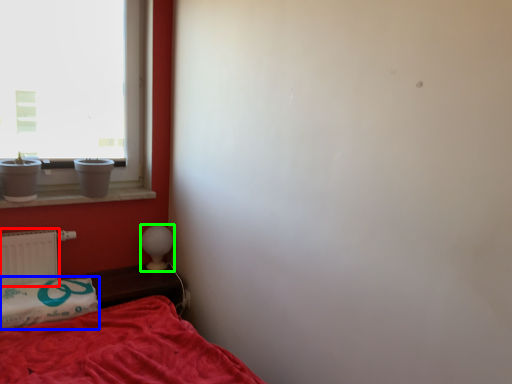
Question: Which object is positioned closest to radiator (highlighted by a red box)? Select from pillow (highlighted by a blue box) and table lamp (highlighted by a green box).

Choices:
 (A) pillow
 (B) table lamp

Answer: (A)